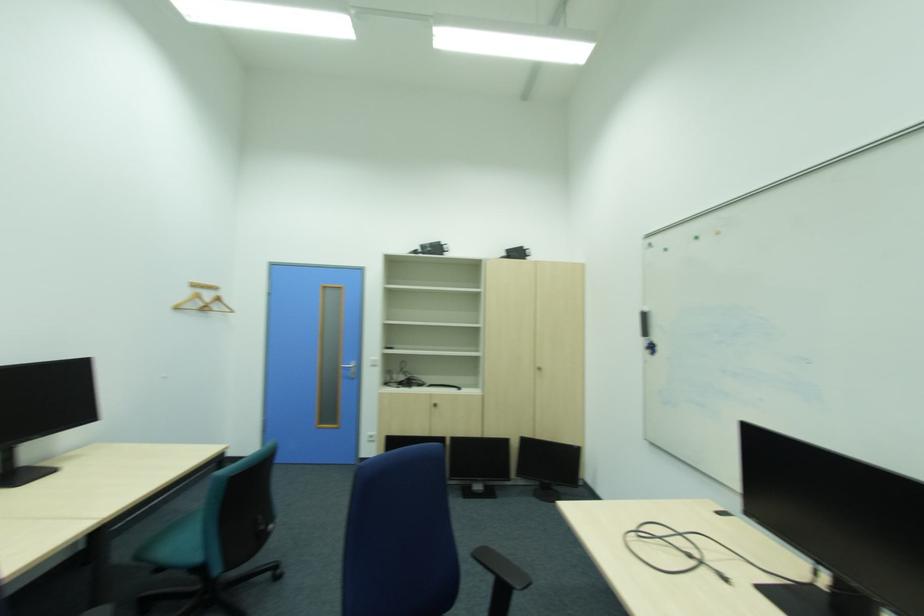
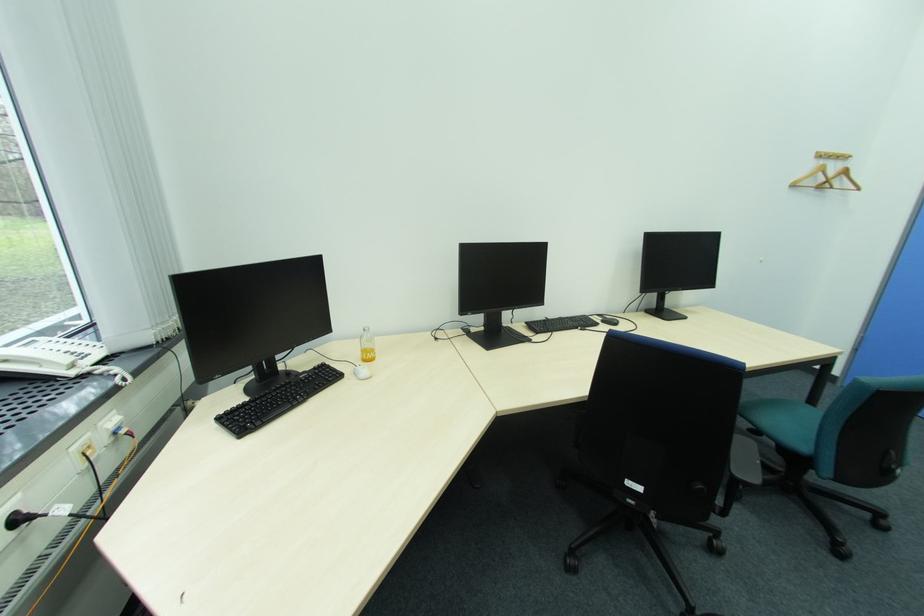
In the second image, find the point that corresponds to point 199,292 in the first image.

(819, 164)